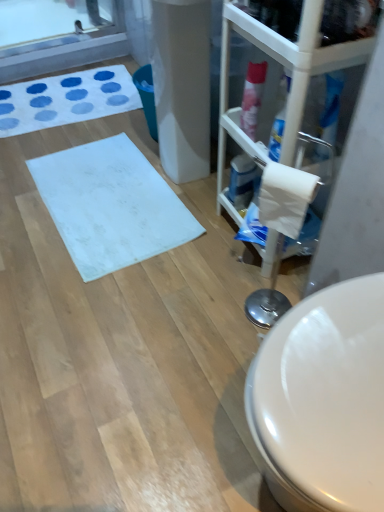
Question: From the image's perspective, is white fabric bath mat at upper left, the first bath mat from the top, beneath white matte bath mat at center, which is counted as the first bath mat, starting from the bottom?

Choices:
 (A) no
 (B) yes

Answer: (A)

Question: Considering the relative sizes of white fabric bath mat at upper left, which is the 2th bath mat in front-to-back order, and white matte bath mat at center, which is counted as the second bath mat, starting from the top, in the image provided, is white fabric bath mat at upper left, which is the 2th bath mat in front-to-back order, thinner than white matte bath mat at center, which is counted as the second bath mat, starting from the top,?

Choices:
 (A) no
 (B) yes

Answer: (A)

Question: Is white fabric bath mat at upper left, which ranks as the 2th bath mat in bottom-to-top order, closer to camera compared to white matte bath mat at center, which is the 1th bath mat in front-to-back order?

Choices:
 (A) no
 (B) yes

Answer: (A)

Question: Is white fabric bath mat at upper left, which is the 1th bath mat from back to front, placed right next to white matte bath mat at center, which is counted as the first bath mat, starting from the bottom?

Choices:
 (A) no
 (B) yes

Answer: (A)

Question: Can you confirm if white fabric bath mat at upper left, which ranks as the 2th bath mat in bottom-to-top order, is smaller than white matte bath mat at center, which is counted as the second bath mat, starting from the top?

Choices:
 (A) no
 (B) yes

Answer: (A)

Question: From their relative heights in the image, would you say pink glossy spray can at upper right, the second cleaning product positioned from the bottom, is taller or shorter than transparent plastic glass door at right?

Choices:
 (A) tall
 (B) short

Answer: (B)

Question: Is point (258, 109) closer or farther from the camera than point (223, 17)?

Choices:
 (A) farther
 (B) closer

Answer: (A)

Question: Is pink glossy spray can at upper right, positioned as the second cleaning product in back-to-front order, wider or thinner than transparent plastic glass door at right?

Choices:
 (A) wide
 (B) thin

Answer: (B)

Question: From a real-world perspective, is pink glossy spray can at upper right, the second cleaning product positioned from the bottom, positioned above or below transparent plastic glass door at right?

Choices:
 (A) above
 (B) below

Answer: (A)

Question: From the image's perspective, relative to pink glossy spray can at upper right, the first cleaning product when ordered from front to back, is white matte bath mat at center, which is counted as the second bath mat, starting from the top, above or below?

Choices:
 (A) below
 (B) above

Answer: (A)

Question: From a real-world perspective, is white matte bath mat at center, which is counted as the first bath mat, starting from the bottom, physically located above or below pink glossy spray can at upper right, the second cleaning product positioned from the bottom?

Choices:
 (A) below
 (B) above

Answer: (A)

Question: Would you say white matte bath mat at center, the second bath mat from the back, is to the left or to the right of pink glossy spray can at upper right, the 1th cleaning product from the top, in the picture?

Choices:
 (A) left
 (B) right

Answer: (A)

Question: In terms of height, does white matte bath mat at center, which is the 1th bath mat in front-to-back order, look taller or shorter compared to pink glossy spray can at upper right, the 1th cleaning product from the top?

Choices:
 (A) tall
 (B) short

Answer: (B)

Question: Visually, is white matte toilet paper at right positioned to the left or to the right of white matte bath mat at center, which is counted as the first bath mat, starting from the bottom?

Choices:
 (A) left
 (B) right

Answer: (B)

Question: In the image, is white matte toilet paper at right positioned in front of or behind white matte bath mat at center, the second bath mat from the back?

Choices:
 (A) behind
 (B) front

Answer: (B)